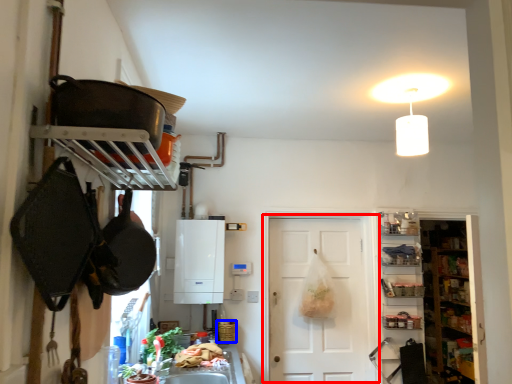
Question: Which object is further to the camera taking this photo, door (highlighted by a red box) or basket (highlighted by a blue box)?

Choices:
 (A) door
 (B) basket

Answer: (A)